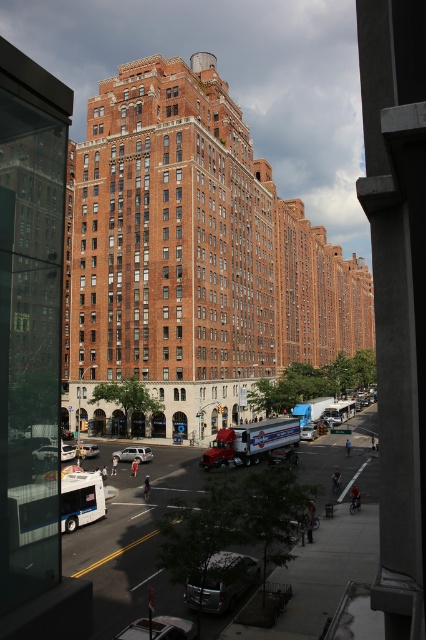
You are standing at the intersection and see two points marked on the ground. The first point is at coordinates point (66, 451) and the second is at point (89, 452). From your perspective, which point is closer to you?

Point (66, 451) is in front of point (89, 452), so it is closer to you.